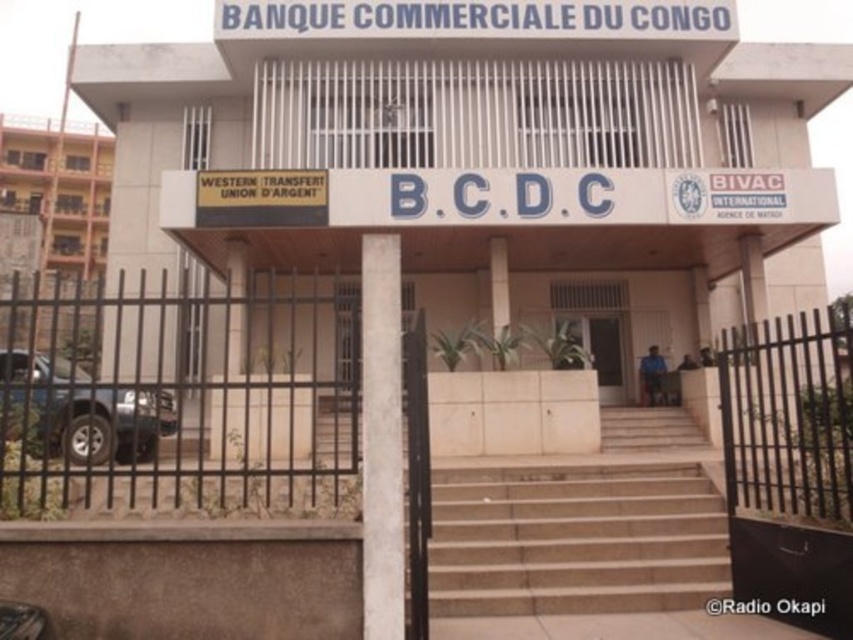
Does beige concrete stairs at center lie behind white concrete pole at center?

That is True.

Is point (659, 513) closer to camera compared to point (380, 330)?

No.

I want to click on beige concrete stairs at center, so click(x=575, y=540).

Which is more to the left, white concrete pole at center or blue metallic car at lower left?

From the viewer's perspective, blue metallic car at lower left appears more on the left side.

Who is positioned more to the right, white concrete pole at center or blue metallic car at lower left?

white concrete pole at center is more to the right.

The width and height of the screenshot is (853, 640). I want to click on white concrete pole at center, so click(x=381, y=436).

Find the location of a particular element. Image resolution: width=853 pixels, height=640 pixels. white concrete pole at center is located at coordinates tap(381, 436).

Image resolution: width=853 pixels, height=640 pixels. What do you see at coordinates (575, 540) in the screenshot?
I see `beige concrete stairs at center` at bounding box center [575, 540].

Is beige concrete stairs at center shorter than blue metallic car at lower left?

Yes, beige concrete stairs at center is shorter than blue metallic car at lower left.

Describe the element at coordinates (575, 540) in the screenshot. This screenshot has height=640, width=853. I see `beige concrete stairs at center` at that location.

This screenshot has height=640, width=853. I want to click on beige concrete stairs at center, so click(575, 540).